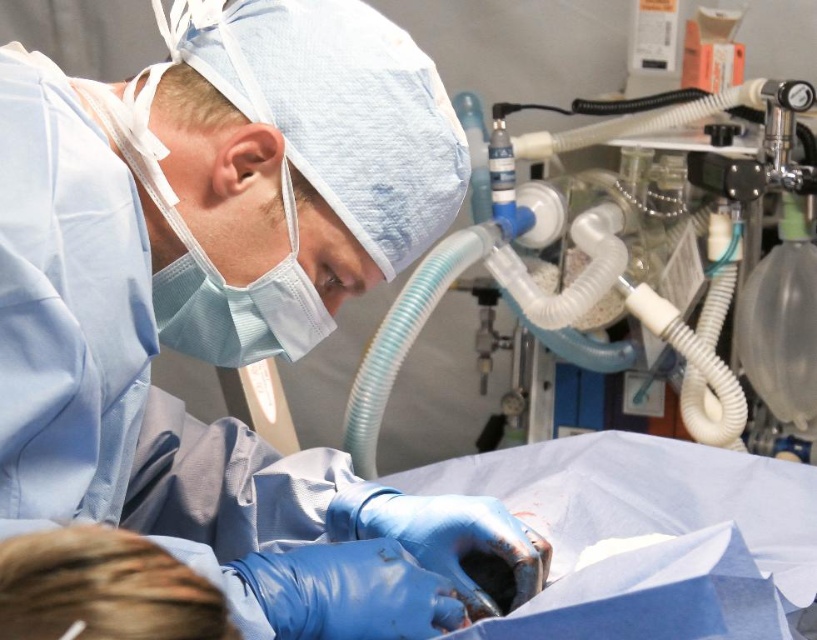
Question: Among these points, which one is nearest to the camera?

Choices:
 (A) (65, 236)
 (B) (646, 324)

Answer: (A)

Question: Does blue latex gloves at lower center appear over white rubber tubing at upper right?

Choices:
 (A) no
 (B) yes

Answer: (A)

Question: Which point is farther to the camera?

Choices:
 (A) (32, 333)
 (B) (744, 189)

Answer: (B)

Question: Among these points, which one is farthest from the camera?

Choices:
 (A) (185, 444)
 (B) (347, 436)

Answer: (B)

Question: Does blue latex gloves at lower center come in front of white rubber tubing at upper right?

Choices:
 (A) no
 (B) yes

Answer: (B)

Question: Can you confirm if blue latex gloves at lower center is bigger than white rubber tubing at upper right?

Choices:
 (A) no
 (B) yes

Answer: (A)